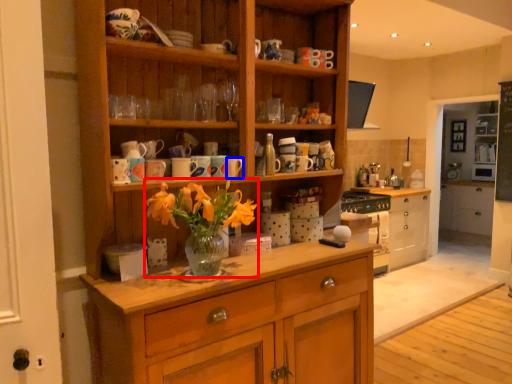
Question: Which object is further to the camera taking this photo, floral arrangement (highlighted by a red box) or mug (highlighted by a blue box)?

Choices:
 (A) floral arrangement
 (B) mug

Answer: (B)